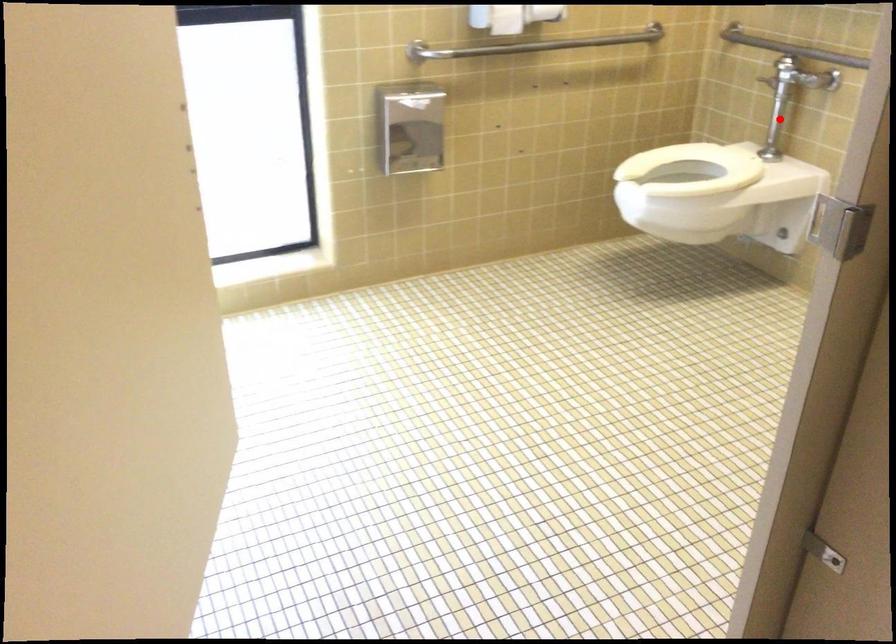
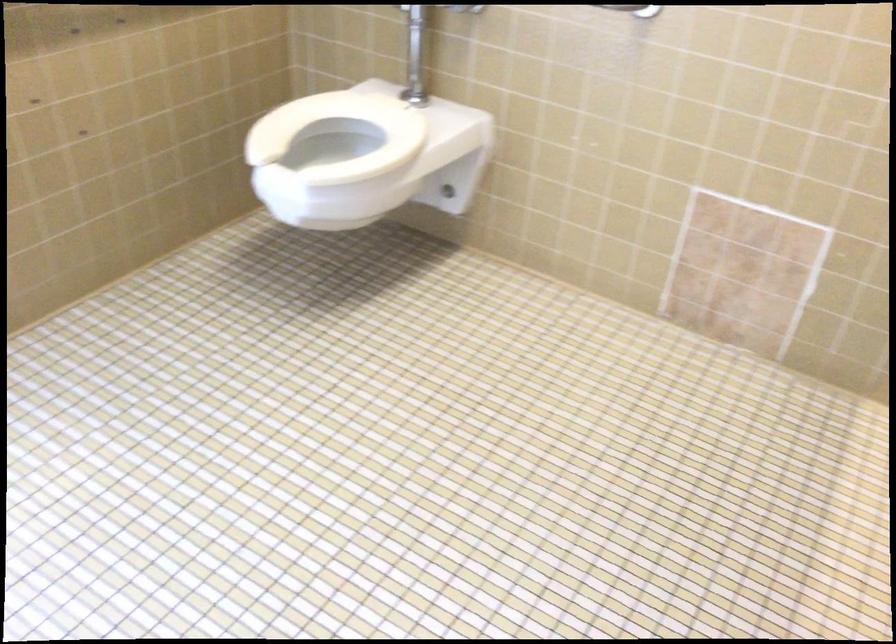
The point at the highlighted location is marked in the first image. Where is the corresponding point in the second image?

(415, 55)